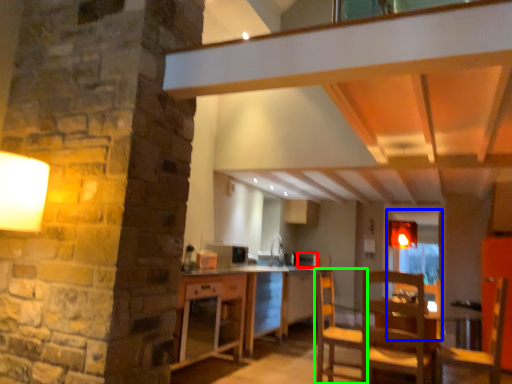
Question: Based on their relative distances, which object is farther from appliance (highlighted by a red box)? Choose from glass door (highlighted by a blue box) and chair (highlighted by a green box).

Choices:
 (A) glass door
 (B) chair

Answer: (B)